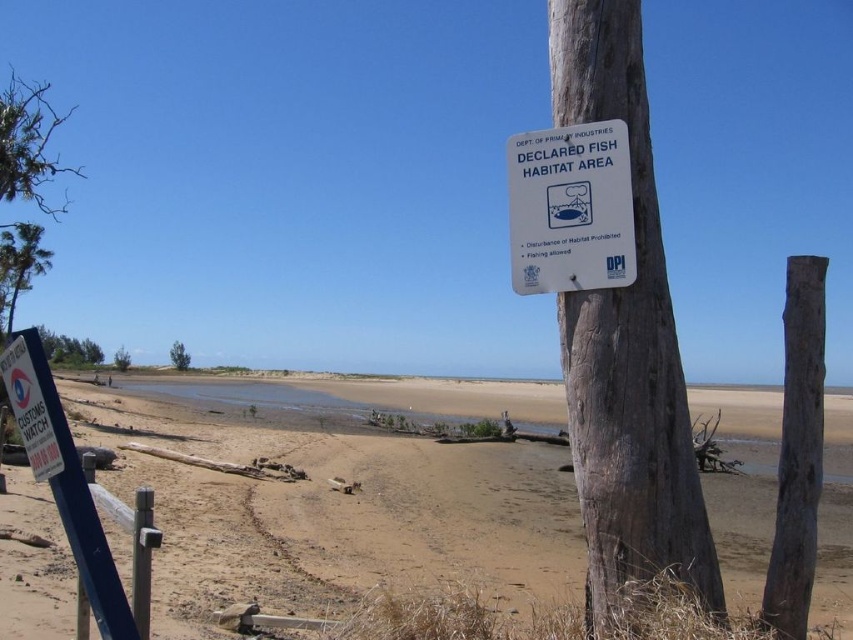
Question: Based on their relative distances, which object is farther from the brown rough wood post at right?

Choices:
 (A) sandy brown beach at lower center
 (B) wooden sign at center
 (C) white plastic sign at upper center

Answer: (A)

Question: Can you confirm if white plastic sign at upper center is positioned to the left of brown rough wood post at right?

Choices:
 (A) no
 (B) yes

Answer: (B)

Question: Does wooden sign at center appear over white plastic sign at upper center?

Choices:
 (A) no
 (B) yes

Answer: (A)

Question: Among these points, which one is nearest to the camera?

Choices:
 (A) (614, 108)
 (B) (624, 211)

Answer: (B)

Question: Which of the following is the farthest from the observer?

Choices:
 (A) brown rough wood post at right
 (B) white plastic sign at upper center
 (C) wooden sign at center

Answer: (B)

Question: Does white plastic sign at upper center appear on the left side of brown rough wood post at right?

Choices:
 (A) no
 (B) yes

Answer: (B)